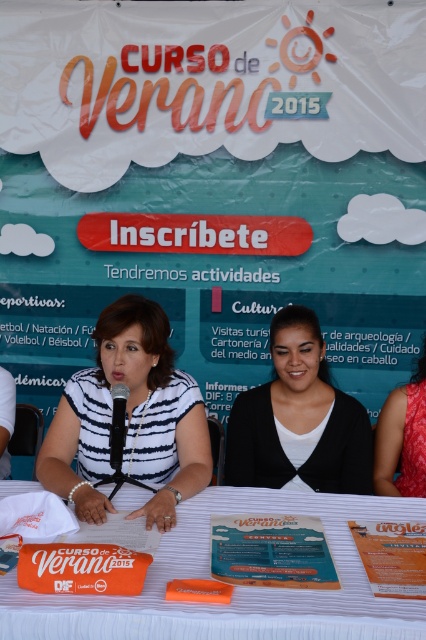
You are planning to place a decorative item on the white fabric table at center and the red satin dress at right. Which surface can accommodate a larger item?

The white fabric table at center can accommodate a larger item because it is larger in size than the red satin dress at right.

You are a photographer at the event and want to take a photo of the two people wearing the red satin dress at right and the white striped shirt at left. Which one should you focus on first if you want to capture both in the frame?

The red satin dress at right is positioned on the right side of white striped shirt at left, so you should focus on the white striped shirt at left first to ensure both are in the frame.

You are standing in front of the promotional event backdrop for Curso de Verano 2015. There are two points marked on the table in the foreground. The first point is at coordinates point (351, 563) and the second point is at point (397, 445). Which of these two points is closer to you?

Point (351, 563) is closer to the viewer than point (397, 445).